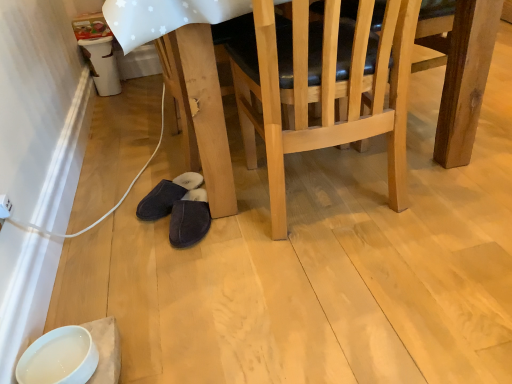
The width and height of the screenshot is (512, 384). In order to click on free spot to the right of dark suede slippers at lower center, the first footwear when ordered from right to left in this screenshot , I will do `click(250, 221)`.